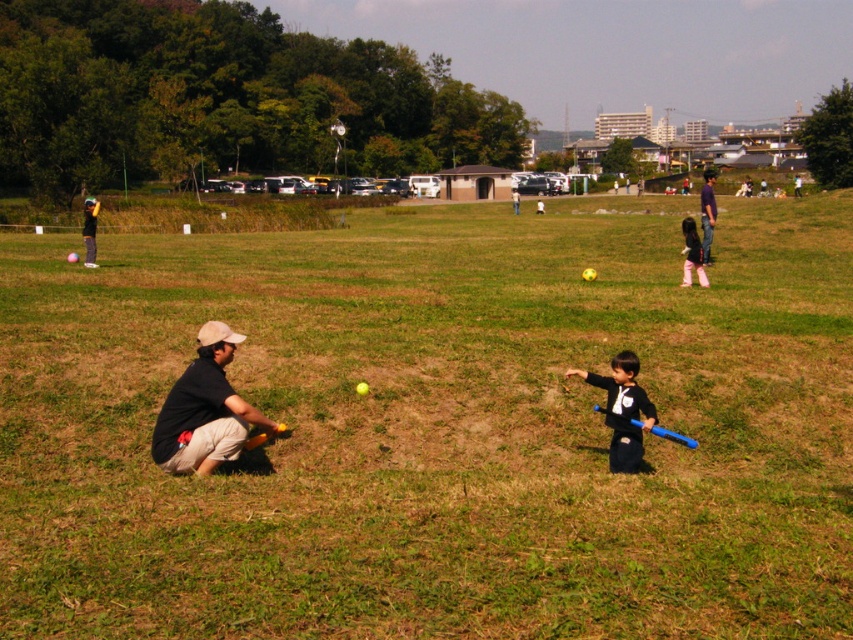
Question: Which point appears farthest from the camera in this image?

Choices:
 (A) (265, 438)
 (B) (706, 220)
 (C) (634, 470)
 (D) (630, 420)

Answer: (B)

Question: Estimate the real-world distances between objects in this image. Which object is farther from the dark blue shirt at right?

Choices:
 (A) green grass at center
 (B) blue plastic bat at lower center

Answer: (B)

Question: Is black fabric squat at lower left positioned in front of yellow matte baseball bat at lower center?

Choices:
 (A) yes
 (B) no

Answer: (A)

Question: Is black fabric squat at lower left smaller than yellow matte baseball bat at lower center?

Choices:
 (A) yes
 (B) no

Answer: (B)

Question: Can you confirm if black fabric pants at right is bigger than yellow matte baseball bat at lower center?

Choices:
 (A) no
 (B) yes

Answer: (B)

Question: Which object is positioned farthest from the yellow matte baseball bat at lower center?

Choices:
 (A) black fabric pants at right
 (B) black matte baseball bat at lower center

Answer: (A)